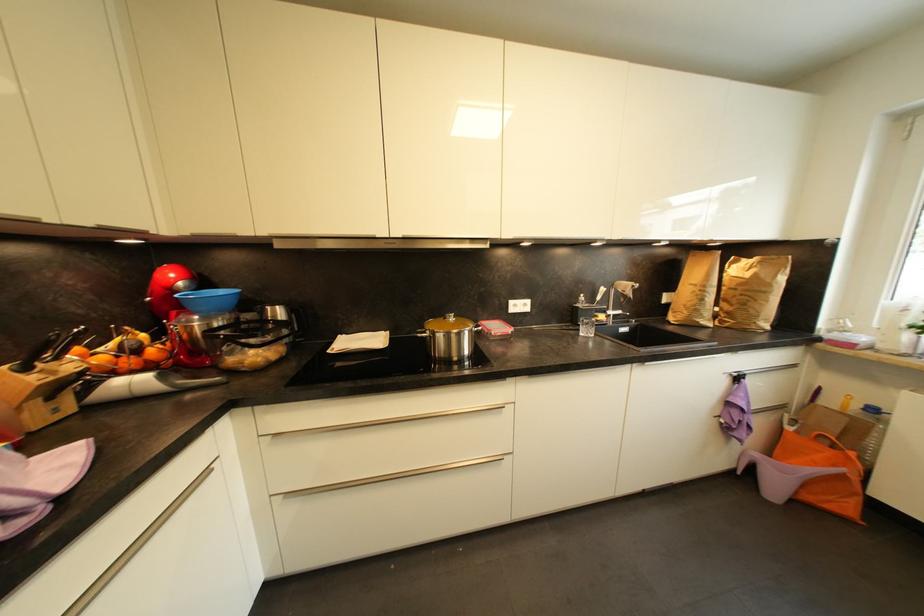
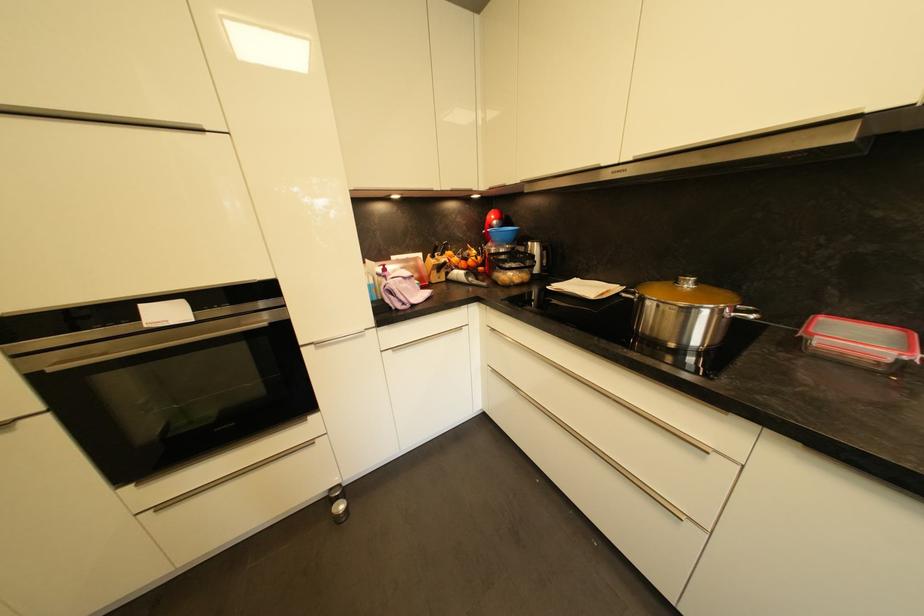
Where in the second image is the point corresponding to point 134,363 from the first image?

(468, 265)